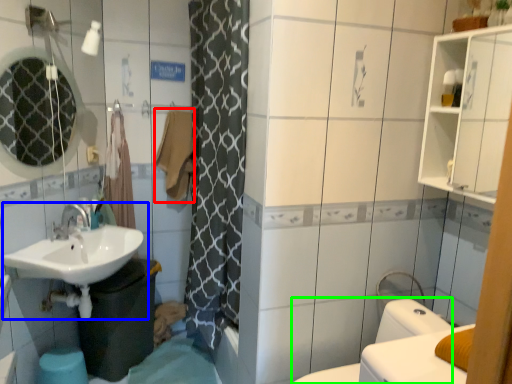
Question: Which is farther away from bath towel (highlighted by a red box)? sink (highlighted by a blue box) or bidet (highlighted by a green box)?

Choices:
 (A) sink
 (B) bidet

Answer: (B)